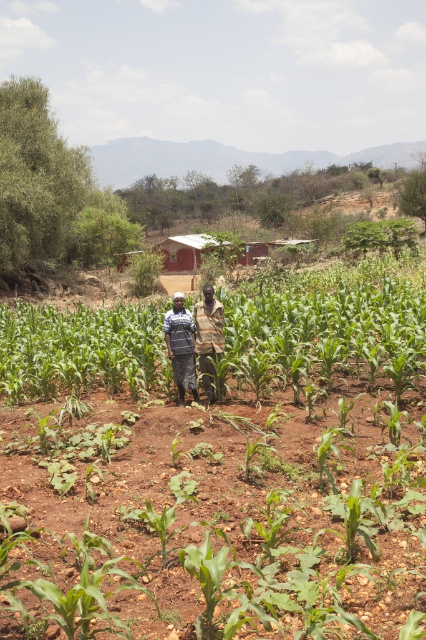
Question: From the image, what is the correct spatial relationship of green leafy corn at center in relation to dark blue shirt at center?

Choices:
 (A) left
 (B) right

Answer: (A)

Question: Among these objects, which one is farthest from the camera?

Choices:
 (A) green leafy corn at center
 (B) camouflage fabric shirt at center
 (C) dark blue shirt at center

Answer: (C)

Question: Does green leafy corn at center have a larger size compared to camouflage fabric shirt at center?

Choices:
 (A) yes
 (B) no

Answer: (A)

Question: Is dark blue shirt at center bigger than camouflage fabric shirt at center?

Choices:
 (A) yes
 (B) no

Answer: (B)

Question: Which object is closer to the camera taking this photo?

Choices:
 (A) green leafy corn at center
 (B) camouflage fabric shirt at center

Answer: (A)

Question: Which point is closer to the camera?

Choices:
 (A) dark blue shirt at center
 (B) green leafy corn at center
 (C) camouflage fabric shirt at center

Answer: (B)